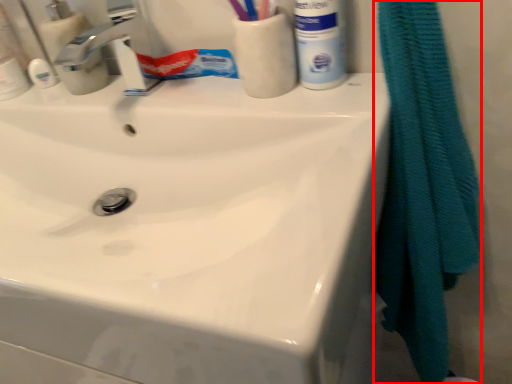
Question: From the image's perspective, considering the relative positions of bath towel (annotated by the red box) and mouthwash in the image provided, where is bath towel (annotated by the red box) located with respect to the staircase?

Choices:
 (A) above
 (B) below

Answer: (B)